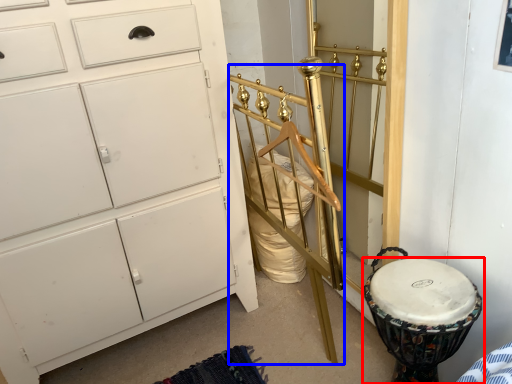
Question: Which of the following is the closest to the observer, drum (highlighted by a red box) or bed frame (highlighted by a blue box)?

Choices:
 (A) drum
 (B) bed frame

Answer: (B)